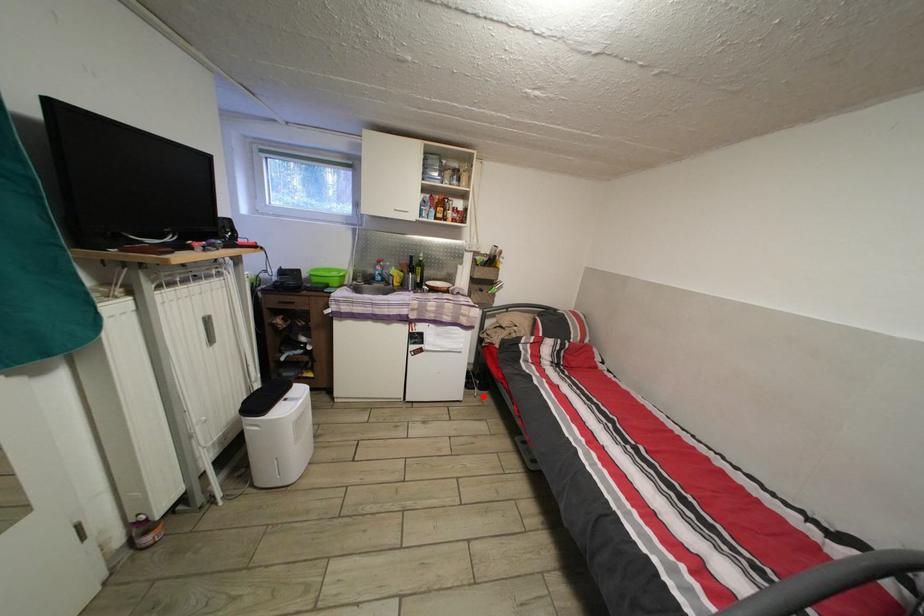
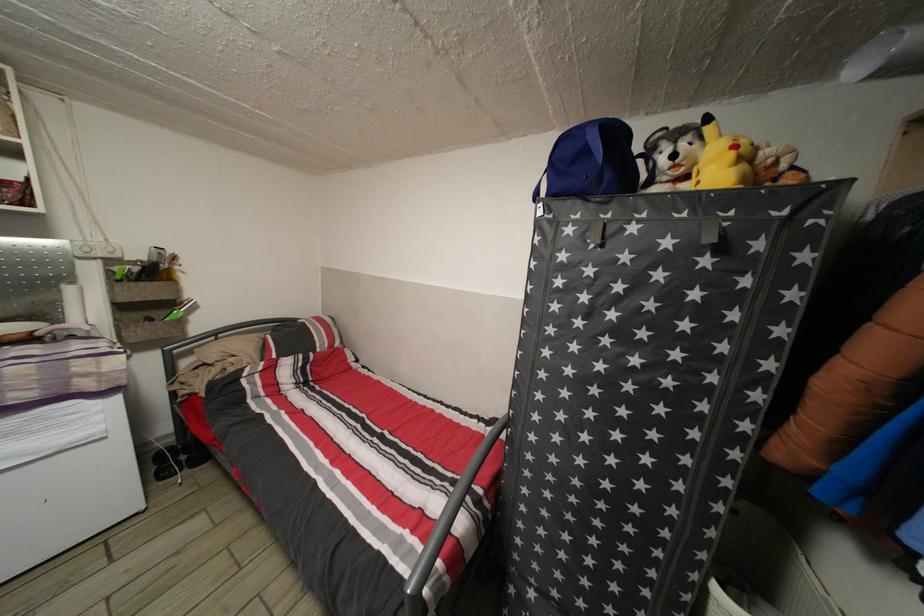
Question: A red point is marked in image1. In image2, is the corresponding 3D point closer to the camera or farther? Reply with the corresponding letter.

Choices:
 (A) The corresponding 3D point is closer.
 (B) The corresponding 3D point is farther.

Answer: (A)